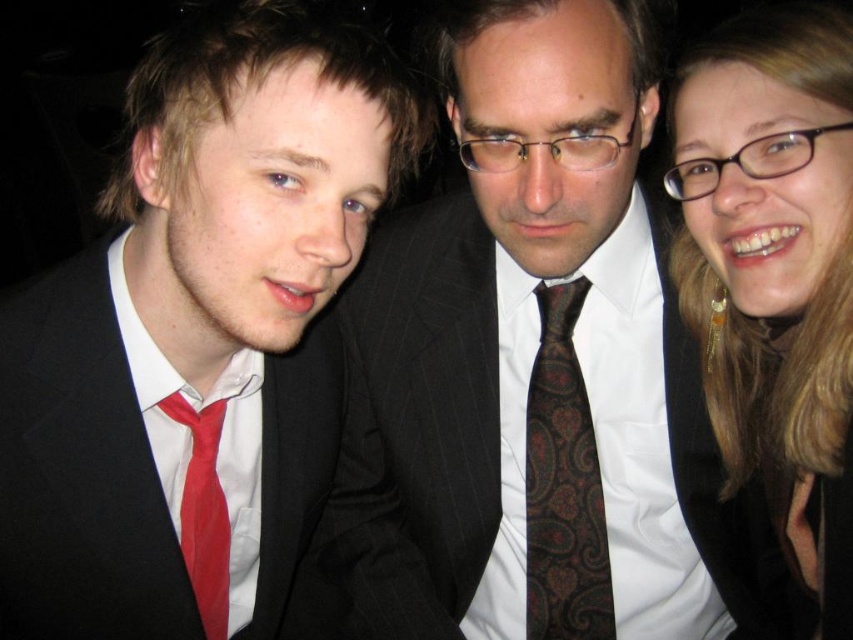
You are taking a photo of three people standing in a line. You notice two points marked on the photo at coordinates point (579, 456) and point (167, 413). Which point is closer to the camera?

Point (579, 456) is further to the camera than point (167, 413), so the point closer to the camera is point (167, 413).

Based on the scene description, which object is positioned higher in the image? The matte black jacket at upper right or the brown paisley tie at center?

The matte black jacket at upper right is positioned higher in the image than the brown paisley tie at center according to the description.